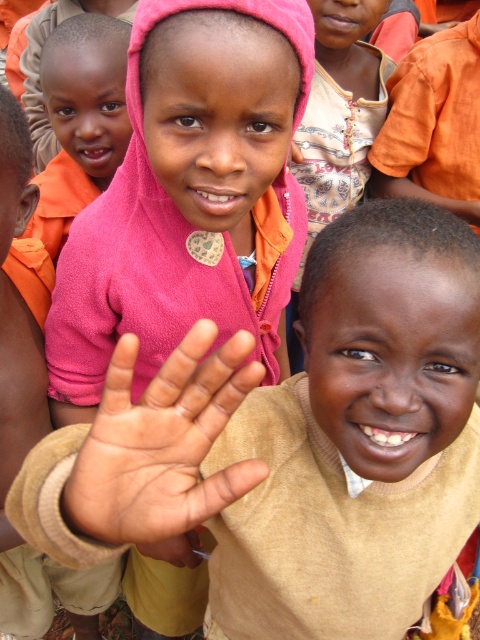
Question: Which of the following is the farthest from the observer?

Choices:
 (A) pink fabric hand at center
 (B) pink fleece at upper center

Answer: (B)

Question: Among these objects, which one is farthest from the camera?

Choices:
 (A) pink fleece at center
 (B) pink fabric hand at center
 (C) pink fleece at upper center

Answer: (C)

Question: Is beige sweater at center to the right of pink fabric hand at center from the viewer's perspective?

Choices:
 (A) yes
 (B) no

Answer: (A)

Question: Is pink fabric hand at center above pink fleece at upper center?

Choices:
 (A) no
 (B) yes

Answer: (A)

Question: Among these points, which one is nearest to the camera?

Choices:
 (A) (86, 456)
 (B) (145, 241)

Answer: (A)

Question: Is pink fabric hand at center positioned behind pink fleece at upper center?

Choices:
 (A) no
 (B) yes

Answer: (A)